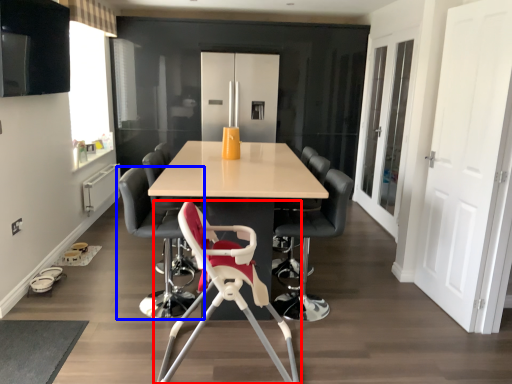
Question: Among these objects, which one is nearest to the camera, chair (highlighted by a red box) or chair (highlighted by a blue box)?

Choices:
 (A) chair
 (B) chair

Answer: (A)